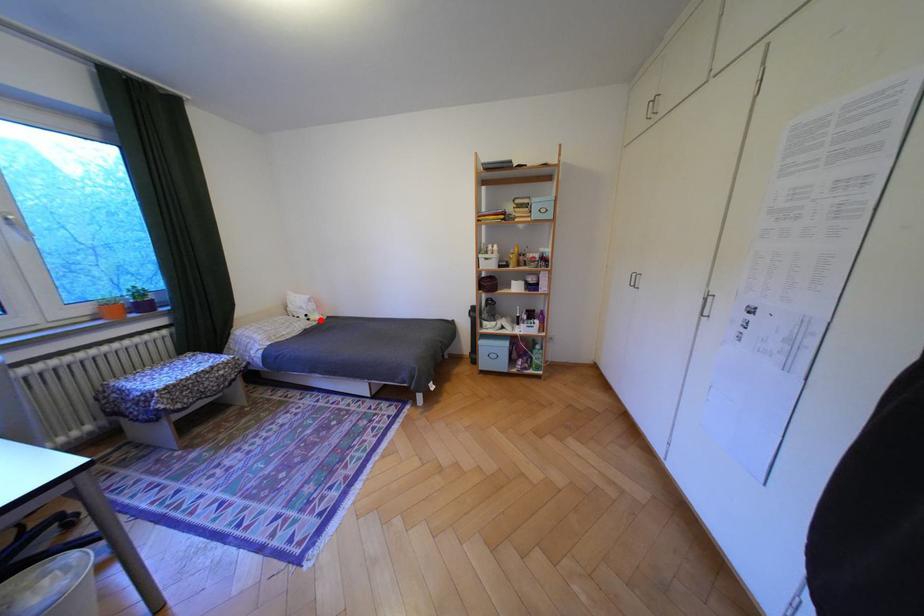
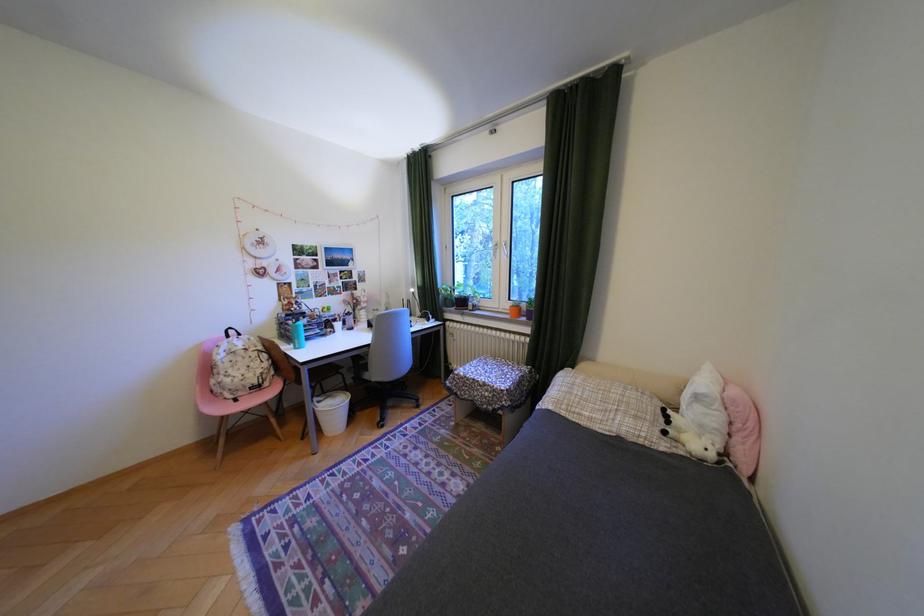
In the second image, find the point that corresponds to the highlighted location in the first image.

(676, 432)